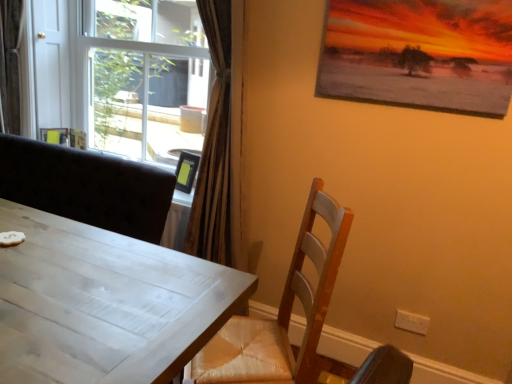
Locate an element on the screen. The image size is (512, 384). white plastic window at upper left is located at coordinates (123, 74).

At what (x,y) coordinates should I click in order to perform the action: click on wooden chair at right. Please return your answer as a coordinate pair (x, y). This screenshot has height=384, width=512. Looking at the image, I should click on (281, 313).

Is velvet-like brown curtain at left to the left or to the right of wooden chair at right in the image?

velvet-like brown curtain at left is positioned on wooden chair at right's left side.

From the image's perspective, does velvet-like brown curtain at left appear lower than wooden chair at right?

Incorrect, from the image's perspective, velvet-like brown curtain at left is higher than wooden chair at right.

Is velvet-like brown curtain at left not close to wooden chair at right?

Absolutely, velvet-like brown curtain at left is distant from wooden chair at right.

Is the position of velvet-like brown curtain at left less distant than that of wooden chair at right?

No, it is behind wooden chair at right.

Is white plastic window at upper left not close to matte wooden picture frame at upper right?

Yes, white plastic window at upper left and matte wooden picture frame at upper right are quite far apart.

Considering the sizes of white plastic window at upper left and matte wooden picture frame at upper right in the image, is white plastic window at upper left wider or thinner than matte wooden picture frame at upper right?

In the image, white plastic window at upper left appears to be wider than matte wooden picture frame at upper right.

You are a GUI agent. You are given a task and a screenshot of the screen. Output one action in this format:
    pyautogui.click(x=<x>, y=<y>)
    Task: Click on the window above the matte wooden picture frame at upper right (from the image's perspective)
    This screenshot has height=384, width=512.
    Given the screenshot: What is the action you would take?
    pyautogui.click(x=123, y=74)

From a real-world perspective, which is physically below, white plastic window at upper left or matte wooden picture frame at upper right?

In real-world perspective, white plastic window at upper left is lower.

Is wooden chair at right looking in the opposite direction of white wood table at left?

That's not correct — wooden chair at right is not looking away from white wood table at left.

From the picture: From a real-world perspective, is wooden chair at right positioned over white wood table at left based on gravity?

Indeed, from a real-world perspective, wooden chair at right stands above white wood table at left.

Which object is closer to the camera, wooden chair at right or white wood table at left?

white wood table at left.

In the scene shown: Considering the sizes of objects wooden chair at right and white wood table at left in the image provided, who is thinner, wooden chair at right or white wood table at left?

Thinner between the two is wooden chair at right.

From a real-world perspective, is matte wooden picture frame at upper right positioned above or below white wood table at left?

In terms of real-world spatial position, matte wooden picture frame at upper right is above white wood table at left.

Is matte wooden picture frame at upper right wider than white wood table at left?

No, matte wooden picture frame at upper right is not wider than white wood table at left.

Can you confirm if matte wooden picture frame at upper right is positioned to the right of white wood table at left?

Correct, you'll find matte wooden picture frame at upper right to the right of white wood table at left.

Between matte wooden picture frame at upper right and white wood table at left, which one is positioned in front?

white wood table at left is closer to the camera.

Based on the photo, can you tell me how much matte wooden picture frame at upper right and velvet-like brown curtain at left differ in facing direction?

matte wooden picture frame at upper right and velvet-like brown curtain at left are facing 5.43 degrees away from each other.

Is matte wooden picture frame at upper right oriented towards velvet-like brown curtain at left?

No, matte wooden picture frame at upper right is not facing towards velvet-like brown curtain at left.

Between matte wooden picture frame at upper right and velvet-like brown curtain at left, which one has larger size?

velvet-like brown curtain at left is bigger.

Looking at this image, is matte wooden picture frame at upper right touching velvet-like brown curtain at left?

No, matte wooden picture frame at upper right is not next to velvet-like brown curtain at left.

Which object is closer to the camera taking this photo, wooden chair at right or matte wooden picture frame at upper right?

wooden chair at right.

Considering the sizes of wooden chair at right and matte wooden picture frame at upper right in the image, is wooden chair at right bigger or smaller than matte wooden picture frame at upper right?

Considering their sizes, wooden chair at right takes up more space than matte wooden picture frame at upper right.

This screenshot has height=384, width=512. I want to click on picture frame that is behind the wooden chair at right, so click(x=420, y=53).

Can you tell me how much wooden chair at right and matte wooden picture frame at upper right differ in facing direction?

wooden chair at right and matte wooden picture frame at upper right are facing 57.2 degrees away from each other.

Can you confirm if white wood table at left is thinner than white plastic window at upper left?

Yes.

Can you confirm if white wood table at left is shorter than white plastic window at upper left?

Correct, white wood table at left is not as tall as white plastic window at upper left.

Is white wood table at left bigger or smaller than white plastic window at upper left?

Clearly, white wood table at left is smaller in size than white plastic window at upper left.

Is point (105, 230) positioned after point (197, 48)?

No, (105, 230) is in front of (197, 48).

The image size is (512, 384). I want to click on chair located underneath the velvet-like brown curtain at left (from a real-world perspective), so click(x=281, y=313).

You are a GUI agent. You are given a task and a screenshot of the screen. Output one action in this format:
    pyautogui.click(x=<x>, y=<y>)
    Task: Click on the picture frame on the right of white plastic window at upper left
    Image resolution: width=512 pixels, height=384 pixels.
    Given the screenshot: What is the action you would take?
    pyautogui.click(x=420, y=53)

Considering their positions, is wooden chair at right positioned further to white wood table at left than white plastic window at upper left?

white plastic window at upper left is further to white wood table at left.

Which object lies further to the anchor point wooden chair at right, white wood table at left or matte wooden picture frame at upper right?

Based on the image, matte wooden picture frame at upper right appears to be further to wooden chair at right.

Based on their spatial positions, is velvet-like brown curtain at left or white wood table at left closer to matte wooden picture frame at upper right?

white wood table at left lies closer to matte wooden picture frame at upper right than the other object.

Considering their positions, is white plastic window at upper left positioned further to wooden chair at right than white wood table at left?

Based on the image, white plastic window at upper left appears to be further to wooden chair at right.

Based on their spatial positions, is white plastic window at upper left or velvet-like brown curtain at left further from wooden chair at right?

Based on the image, velvet-like brown curtain at left appears to be further to wooden chair at right.

Based on their spatial positions, is white wood table at left or velvet-like brown curtain at left closer to matte wooden picture frame at upper right?

The object closer to matte wooden picture frame at upper right is white wood table at left.

Considering their positions, is matte wooden picture frame at upper right positioned further to wooden chair at right than white wood table at left?

The object further to wooden chair at right is matte wooden picture frame at upper right.

Looking at the image, which one is located further to white plastic window at upper left, matte wooden picture frame at upper right or white wood table at left?

matte wooden picture frame at upper right is further to white plastic window at upper left.

The image size is (512, 384). I want to click on chair between white wood table at left and matte wooden picture frame at upper right from left to right, so click(x=281, y=313).

Find the location of a particular element. chair situated between velvet-like brown curtain at left and matte wooden picture frame at upper right from left to right is located at coordinates (281, 313).

Where is `chair positioned between white wood table at left and velvet-like brown curtain at left from near to far`? The image size is (512, 384). chair positioned between white wood table at left and velvet-like brown curtain at left from near to far is located at coordinates (281, 313).

The image size is (512, 384). Identify the location of window positioned between white wood table at left and velvet-like brown curtain at left from near to far. (123, 74).